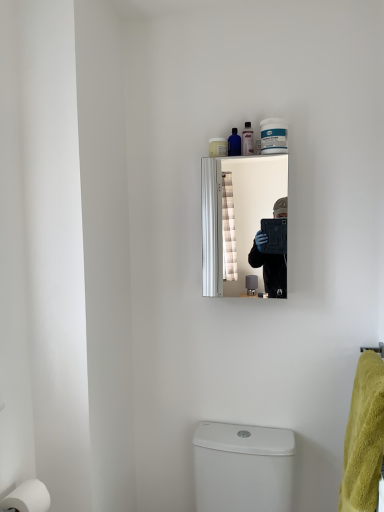
Question: Which direction should I rotate to look at translucent blue bottle at upper center, which is the second toiletry in left-to-right order, — up or down?

Choices:
 (A) up
 (B) down

Answer: (A)

Question: From a real-world perspective, is white glossy toilet at lower center under translucent blue bottle at upper center, which is the second toiletry in left-to-right order?

Choices:
 (A) no
 (B) yes

Answer: (B)

Question: Is white glossy toilet at lower center outside of translucent blue bottle at upper center, which is the second toiletry in left-to-right order?

Choices:
 (A) yes
 (B) no

Answer: (A)

Question: Considering the relative sizes of white glossy toilet at lower center and translucent blue bottle at upper center, which is the second toiletry in left-to-right order, in the image provided, is white glossy toilet at lower center wider than translucent blue bottle at upper center, which is the second toiletry in left-to-right order,?

Choices:
 (A) yes
 (B) no

Answer: (A)

Question: Can you confirm if white glossy toilet at lower center is taller than translucent blue bottle at upper center, which is the second toiletry in left-to-right order?

Choices:
 (A) no
 (B) yes

Answer: (B)

Question: Is translucent blue bottle at upper center, placed as the 2th toiletry when sorted from right to left, surrounded by white glossy toilet at lower center?

Choices:
 (A) yes
 (B) no

Answer: (B)

Question: Is white glossy toilet at lower center aimed at translucent blue bottle at upper center, which is the second toiletry in left-to-right order?

Choices:
 (A) yes
 (B) no

Answer: (B)

Question: From the image's perspective, is translucent plastic bottle at upper center, positioned as the 1th toiletry in right-to-left order, located beneath white matte toilet paper at lower left?

Choices:
 (A) no
 (B) yes

Answer: (A)

Question: Can you confirm if translucent plastic bottle at upper center, positioned as the 3th toiletry in left-to-right order, is taller than white matte toilet paper at lower left?

Choices:
 (A) yes
 (B) no

Answer: (A)

Question: From a real-world perspective, is translucent plastic bottle at upper center, positioned as the 3th toiletry in left-to-right order, under white matte toilet paper at lower left?

Choices:
 (A) yes
 (B) no

Answer: (B)

Question: Can you confirm if translucent plastic bottle at upper center, positioned as the 1th toiletry in right-to-left order, is wider than white matte toilet paper at lower left?

Choices:
 (A) no
 (B) yes

Answer: (A)

Question: Does translucent plastic bottle at upper center, positioned as the 3th toiletry in left-to-right order, appear on the left side of white matte toilet paper at lower left?

Choices:
 (A) no
 (B) yes

Answer: (A)

Question: Is translucent plastic bottle at upper center, positioned as the 3th toiletry in left-to-right order, directly adjacent to white matte toilet paper at lower left?

Choices:
 (A) no
 (B) yes

Answer: (A)

Question: Does silver metallic mirror at upper center have a greater width compared to translucent plastic soap dispenser at upper center, the third toiletry viewed from the right?

Choices:
 (A) no
 (B) yes

Answer: (B)